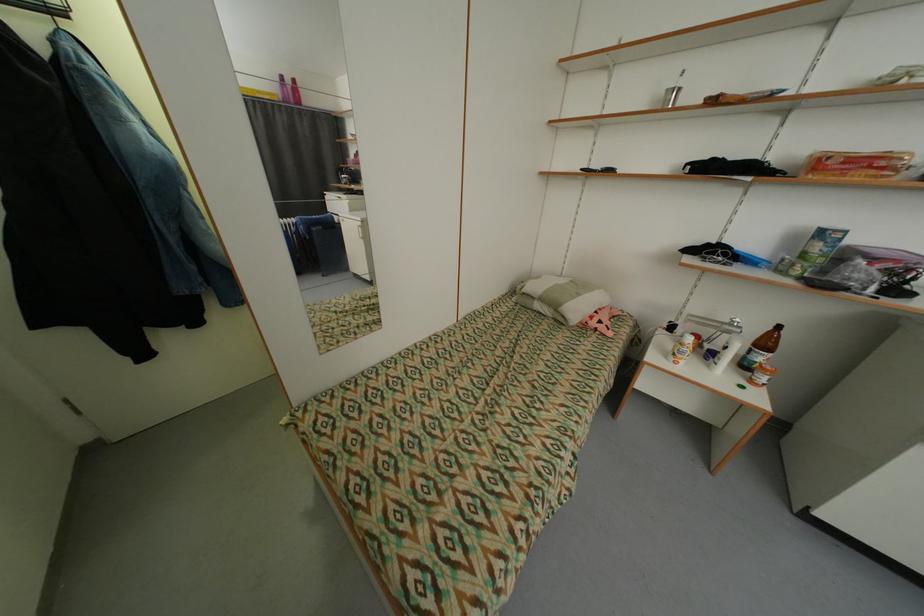
The image size is (924, 616). What do you see at coordinates (724, 329) in the screenshot?
I see `the silver lamp knob` at bounding box center [724, 329].